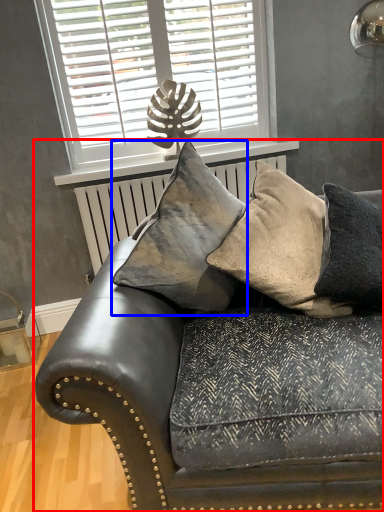
Question: Which object appears closest to the camera in this image, studio couch (highlighted by a red box) or pillow (highlighted by a blue box)?

Choices:
 (A) studio couch
 (B) pillow

Answer: (A)